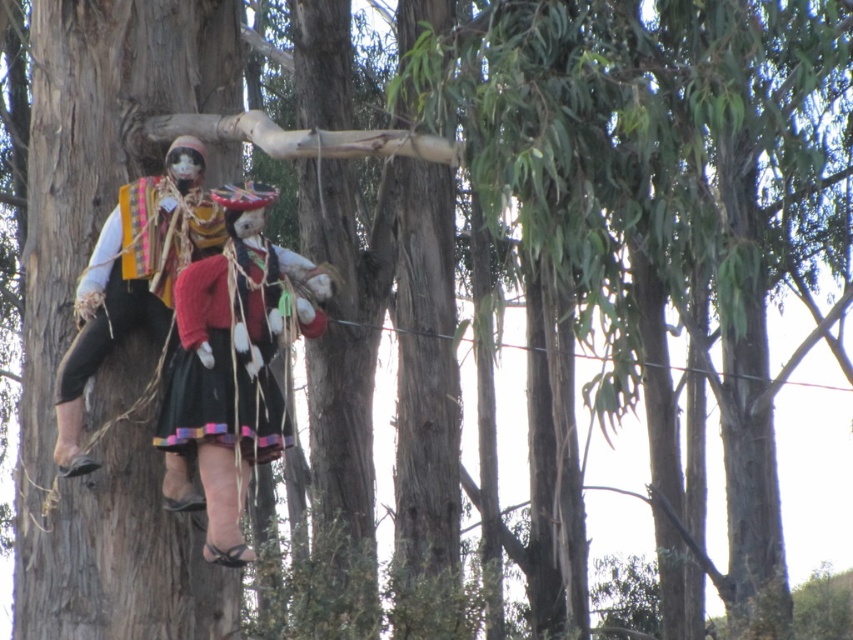
You are an artist planning to paint a scene similar to the one described. You want to ensure the matte black dress at center and the textured fabric doll at center are proportionate to each other. Based on the description, which object should you make wider in your painting?

The textured fabric doll at center should be wider since the matte black dress at center has a lesser width compared to it.

You are an observer standing in front of the scene. You see the matte black dress at center and the textured fabric doll at center. Which object is positioned to the left?

The textured fabric doll at center is positioned to the left of the matte black dress at center.